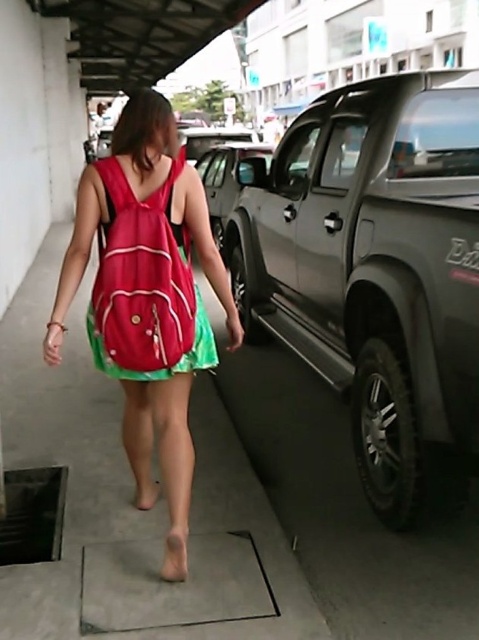
Question: Which of the following is the farthest from the observer?

Choices:
 (A) (105, 168)
 (B) (146, 490)
 (C) (170, 557)

Answer: (B)

Question: Can you confirm if metallic silver car at upper center is positioned above green satin dress at center?

Choices:
 (A) no
 (B) yes

Answer: (B)

Question: Does metallic silver car at upper center have a lesser width compared to nude leather sandal at lower center?

Choices:
 (A) no
 (B) yes

Answer: (A)

Question: Considering the real-world distances, which object is closest to the metallic silver car at upper center?

Choices:
 (A) matte fabric backpack at center
 (B) green fabric pavement at center

Answer: (B)

Question: Is green fabric pavement at center below matte fabric backpack at center?

Choices:
 (A) yes
 (B) no

Answer: (A)

Question: Which point is closer to the camera?

Choices:
 (A) (178, 564)
 (B) (149, 481)
 (C) (470, 36)

Answer: (A)